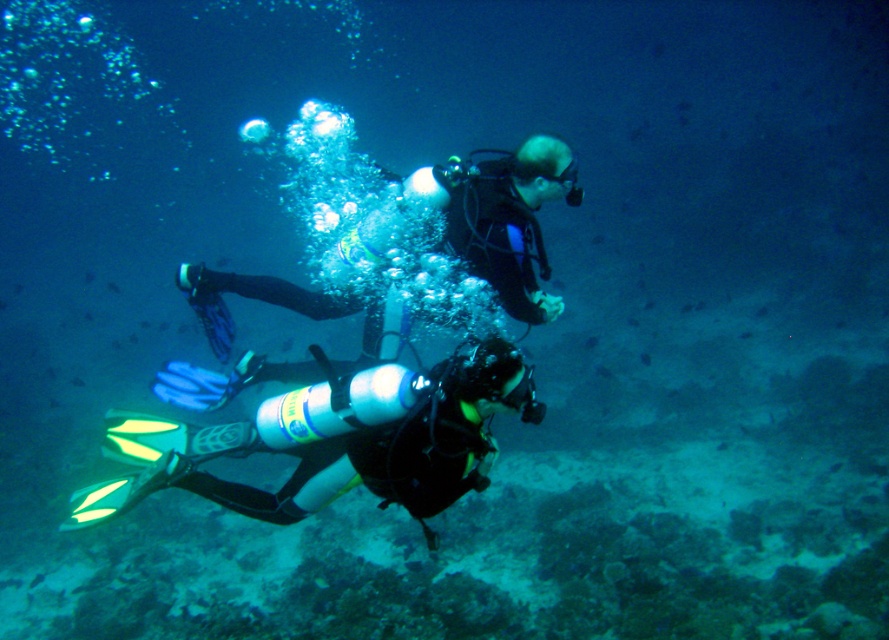
You are a marine biologist observing the underwater scene. You notice the neon yellow fins at center and the black matte scuba diver at center. Based on their positions, which object is closer to the ocean floor?

The neon yellow fins at center is located below the black matte scuba diver at center, so it is closer to the ocean floor.

Consider the image. You are a marine biologist observing underwater life. You notice a point marked at coordinates (x=337, y=442) in the center of the image. What object is located at this point?

The point at coordinates (x=337, y=442) corresponds to neon yellow fins at center.

In the scene shown: You are a scuba diver who needs to retrieve your camera from underwater. Your neon yellow fins at center are essential for maneuvering. If your maximum reach without moving your fins is 2 meters, can you grab your camera?

The neon yellow fins at center and camera are 3.28 meters apart. Since your maximum reach is only 2 meters, you cannot grab the camera without moving your fins.